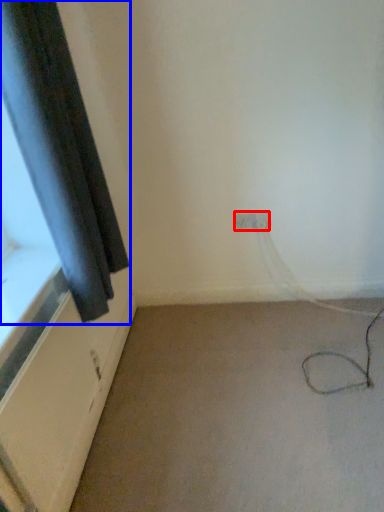
Question: Which of the following is the farthest to the observer, electric outlet (highlighted by a red box) or curtain (highlighted by a blue box)?

Choices:
 (A) electric outlet
 (B) curtain

Answer: (A)